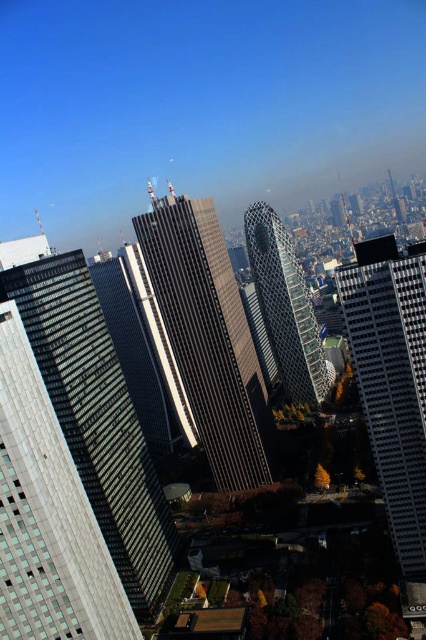
Is point (158, 497) positioned after point (357, 260)?

Yes, it is.

Does silver glass skyscraper at center come in front of metallic glass skyscraper at center?

Yes, it is.

Is point (66, 440) more distant than point (414, 323)?

Yes, point (66, 440) is farther from viewer.

Image resolution: width=426 pixels, height=640 pixels. I want to click on silver glass skyscraper at center, so click(97, 419).

Based on the photo, is glassy reflective skyscraper at center above glassy silver skyscraper at center?

No, glassy reflective skyscraper at center is not above glassy silver skyscraper at center.

Is point (186, 348) positioned after point (261, 289)?

No, (186, 348) is closer to viewer.

Who is more forward, (x=245, y=406) or (x=264, y=282)?

Point (x=245, y=406) is in front.

Find the location of a particular element. The image size is (426, 640). glassy reflective skyscraper at center is located at coordinates (210, 339).

Is point (160, 532) behind point (316, 353)?

No, it is not.

Find the location of a particular element. silver glass skyscraper at center is located at coordinates (97, 419).

In order to click on silver glass skyscraper at center in this screenshot , I will do `click(97, 419)`.